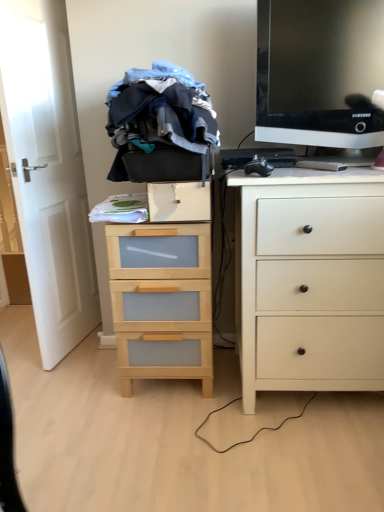
Question: Could you tell me if wooden chest of drawers at center, the 1th chest of drawers from the left, is facing black plastic keyboard at center?

Choices:
 (A) yes
 (B) no

Answer: (B)

Question: Can you confirm if wooden chest of drawers at center, marked as the second chest of drawers in a right-to-left arrangement, is positioned to the right of black plastic keyboard at center?

Choices:
 (A) no
 (B) yes

Answer: (A)

Question: Considering the relative sizes of wooden chest of drawers at center, marked as the second chest of drawers in a right-to-left arrangement, and black plastic keyboard at center in the image provided, is wooden chest of drawers at center, marked as the second chest of drawers in a right-to-left arrangement, wider than black plastic keyboard at center?

Choices:
 (A) yes
 (B) no

Answer: (A)

Question: Considering the relative sizes of wooden chest of drawers at center, marked as the second chest of drawers in a right-to-left arrangement, and black plastic keyboard at center in the image provided, is wooden chest of drawers at center, marked as the second chest of drawers in a right-to-left arrangement, shorter than black plastic keyboard at center?

Choices:
 (A) yes
 (B) no

Answer: (B)

Question: From a real-world perspective, is wooden chest of drawers at center, marked as the second chest of drawers in a right-to-left arrangement, located higher than black plastic keyboard at center?

Choices:
 (A) no
 (B) yes

Answer: (A)

Question: Is black plastic computer mouse at upper right inside or outside of wooden chest of drawers at center, the 1th chest of drawers from the left?

Choices:
 (A) outside
 (B) inside

Answer: (A)

Question: In the image, is black plastic computer mouse at upper right positioned in front of or behind wooden chest of drawers at center, the 1th chest of drawers from the left?

Choices:
 (A) behind
 (B) front

Answer: (B)

Question: Is black plastic computer mouse at upper right to the left or to the right of wooden chest of drawers at center, marked as the second chest of drawers in a right-to-left arrangement, in the image?

Choices:
 (A) right
 (B) left

Answer: (A)

Question: From a real-world perspective, is black plastic computer mouse at upper right above or below wooden chest of drawers at center, the 1th chest of drawers from the left?

Choices:
 (A) above
 (B) below

Answer: (A)

Question: Relative to black plastic keyboard at center, is black glossy monitor at upper right in front or behind?

Choices:
 (A) front
 (B) behind

Answer: (A)

Question: Considering the positions of black glossy monitor at upper right and black plastic keyboard at center in the image, is black glossy monitor at upper right taller or shorter than black plastic keyboard at center?

Choices:
 (A) short
 (B) tall

Answer: (B)

Question: Is point (294, 104) positioned closer to the camera than point (289, 160)?

Choices:
 (A) farther
 (B) closer

Answer: (A)

Question: From a real-world perspective, is black glossy monitor at upper right positioned above or below black plastic keyboard at center?

Choices:
 (A) above
 (B) below

Answer: (A)

Question: Is black plastic keyboard at center taller or shorter than wooden chest of drawers at center, the 1th chest of drawers from the left?

Choices:
 (A) short
 (B) tall

Answer: (A)

Question: Is black plastic keyboard at center in front of or behind wooden chest of drawers at center, the 1th chest of drawers from the left, in the image?

Choices:
 (A) front
 (B) behind

Answer: (B)